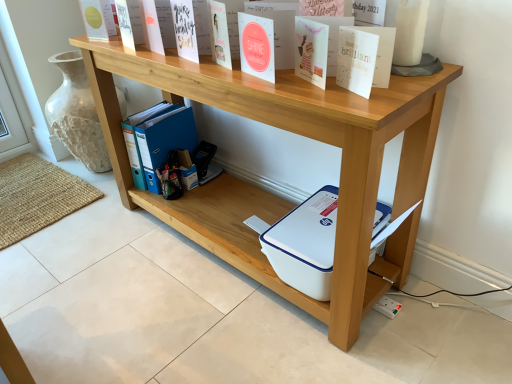
Where is `vacant area to the left of white paper at upper right, arranged as the third paperback book when viewed from the left`? This screenshot has width=512, height=384. vacant area to the left of white paper at upper right, arranged as the third paperback book when viewed from the left is located at coordinates (303, 90).